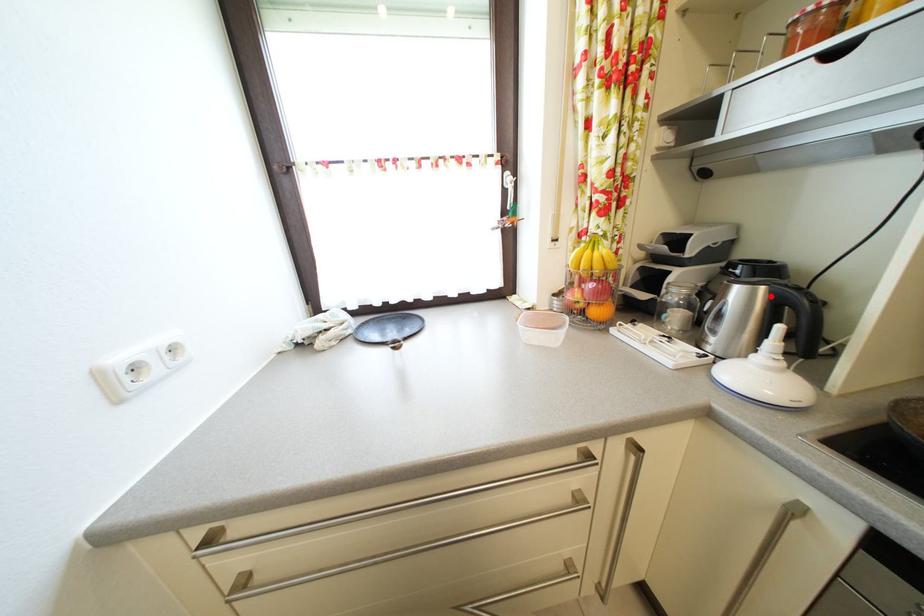
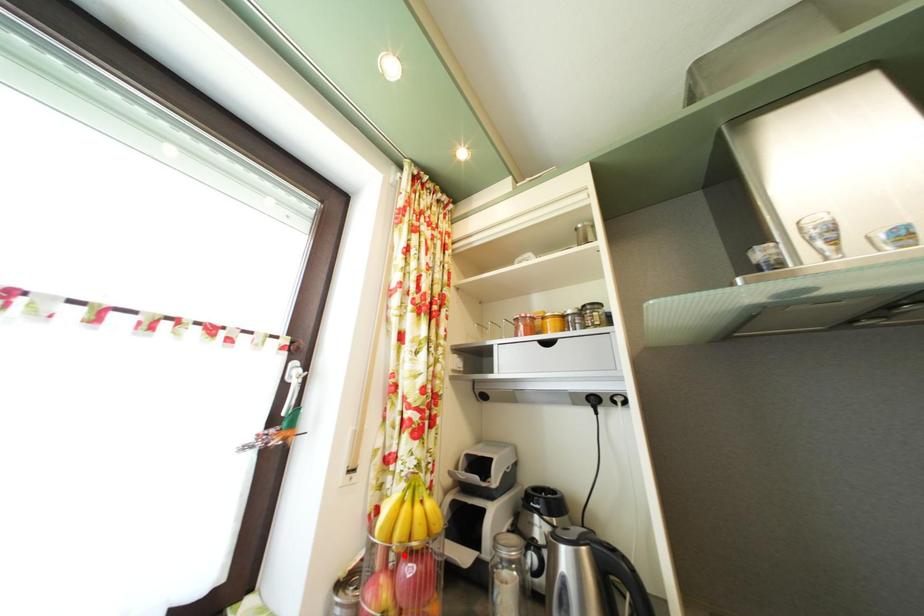
I am providing you with two images of the same scene from different viewpoints. A red point is marked on the first image and another point is marked on the second image. Is the marked point in image1 the same physical position as the marked point in image2?

No